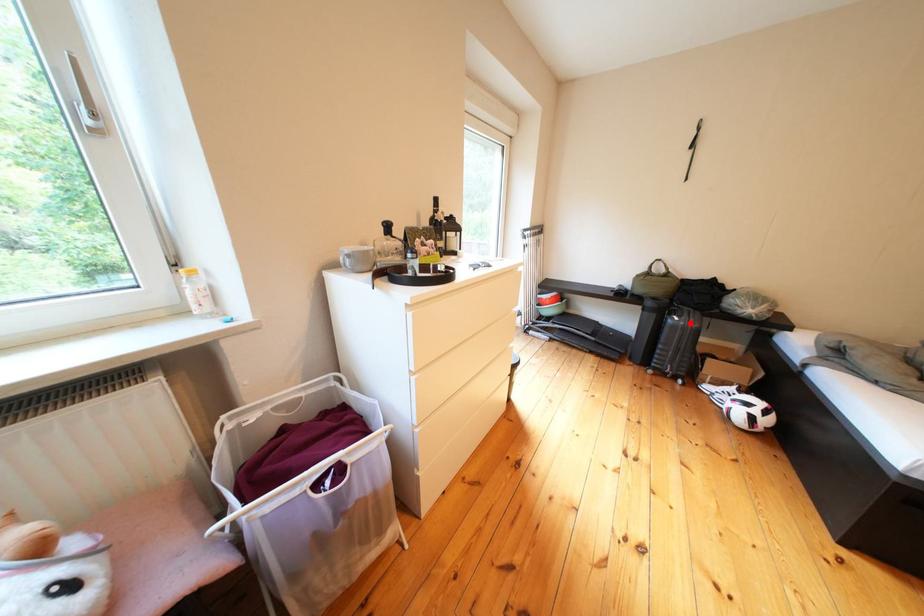
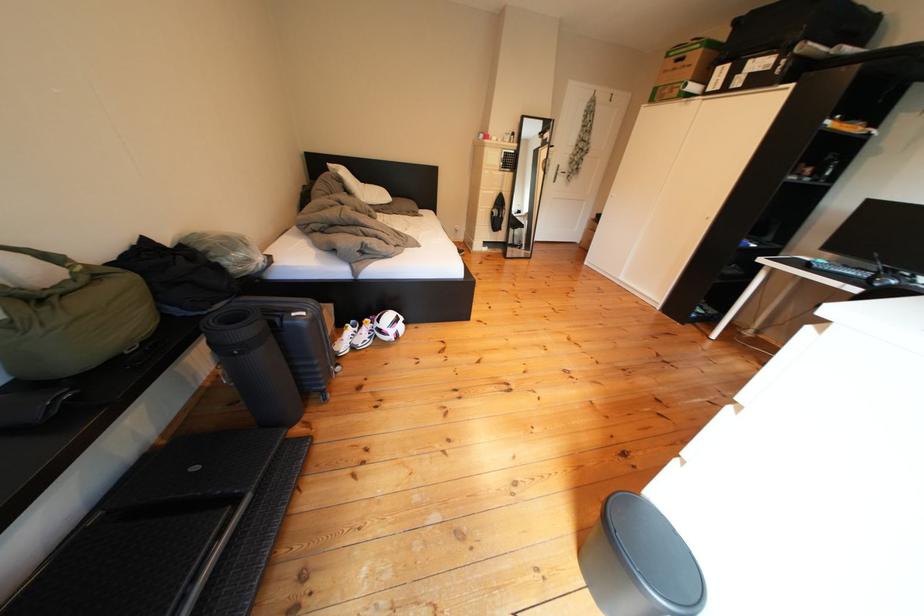
Question: I am providing you with two images of the same scene from different viewpoints. A red point is shown in image1. For the corresponding object point in image2, is it positioned nearer or farther from the camera?

Choices:
 (A) Nearer
 (B) Farther

Answer: (A)